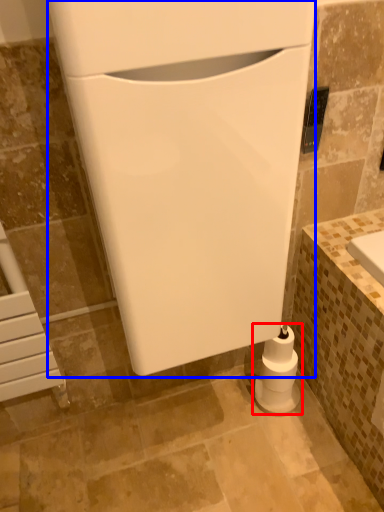
Question: Among these objects, which one is farthest to the camera, toilet paper (highlighted by a red box) or appliance (highlighted by a blue box)?

Choices:
 (A) toilet paper
 (B) appliance

Answer: (A)